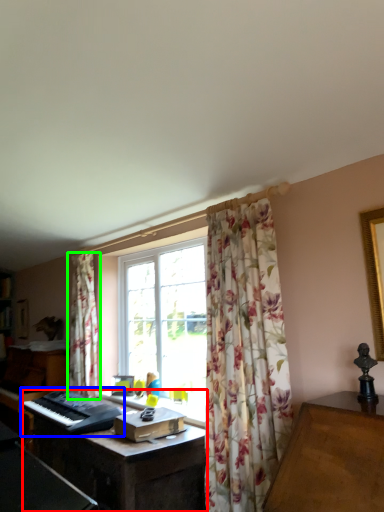
Question: Considering the real-world distances, which object is closest to computer desk (highlighted by a red box)? musical keyboard (highlighted by a blue box) or curtain (highlighted by a green box).

Choices:
 (A) musical keyboard
 (B) curtain

Answer: (A)